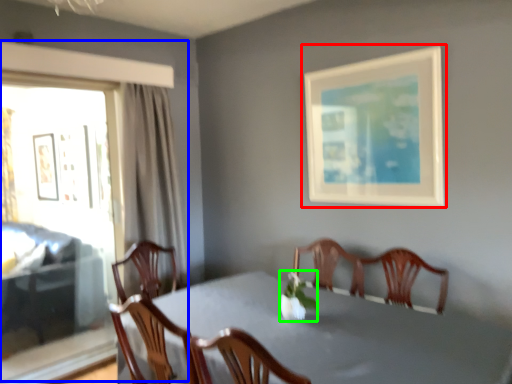
Question: Estimate the real-world distances between objects in this image. Which object is farther from picture frame (highlighted by a red box), window (highlighted by a blue box) or floral arrangement (highlighted by a green box)?

Choices:
 (A) window
 (B) floral arrangement

Answer: (A)